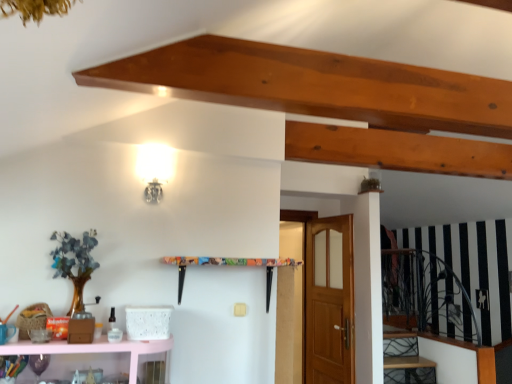
Question: From the image's perspective, is pink glossy shelf at lower left on wooden stairwell at lower right?

Choices:
 (A) yes
 (B) no

Answer: (A)

Question: Is pink glossy shelf at lower left beside wooden stairwell at lower right?

Choices:
 (A) yes
 (B) no

Answer: (B)

Question: Would you say pink glossy shelf at lower left is a long distance from wooden stairwell at lower right?

Choices:
 (A) yes
 (B) no

Answer: (A)

Question: Is pink glossy shelf at lower left at the left side of wooden stairwell at lower right?

Choices:
 (A) yes
 (B) no

Answer: (A)

Question: Does pink glossy shelf at lower left have a larger size compared to wooden stairwell at lower right?

Choices:
 (A) yes
 (B) no

Answer: (A)

Question: Do you think pink glossy shelf at lower left is within wooden stairwell at lower right, or outside of it?

Choices:
 (A) inside
 (B) outside

Answer: (B)

Question: From the image's perspective, is pink glossy shelf at lower left above or below wooden stairwell at lower right?

Choices:
 (A) above
 (B) below

Answer: (A)

Question: From their relative heights in the image, would you say pink glossy shelf at lower left is taller or shorter than wooden stairwell at lower right?

Choices:
 (A) tall
 (B) short

Answer: (B)

Question: Considering the positions of pink glossy shelf at lower left and wooden stairwell at lower right in the image, is pink glossy shelf at lower left bigger or smaller than wooden stairwell at lower right?

Choices:
 (A) big
 (B) small

Answer: (A)

Question: Visually, is pink glossy shelf at lower left positioned to the left or to the right of wooden door at center?

Choices:
 (A) right
 (B) left

Answer: (B)

Question: In terms of width, does pink glossy shelf at lower left look wider or thinner when compared to wooden door at center?

Choices:
 (A) thin
 (B) wide

Answer: (B)

Question: Considering the positions of pink glossy shelf at lower left and wooden door at center in the image, is pink glossy shelf at lower left bigger or smaller than wooden door at center?

Choices:
 (A) big
 (B) small

Answer: (B)

Question: Considering the positions of pink glossy shelf at lower left and wooden door at center in the image, is pink glossy shelf at lower left taller or shorter than wooden door at center?

Choices:
 (A) short
 (B) tall

Answer: (A)

Question: From the image's perspective, is wooden stairwell at lower right positioned above or below pink glossy shelf at lower left?

Choices:
 (A) above
 (B) below

Answer: (B)

Question: Is point (387, 360) positioned closer to the camera than point (18, 352)?

Choices:
 (A) closer
 (B) farther

Answer: (B)